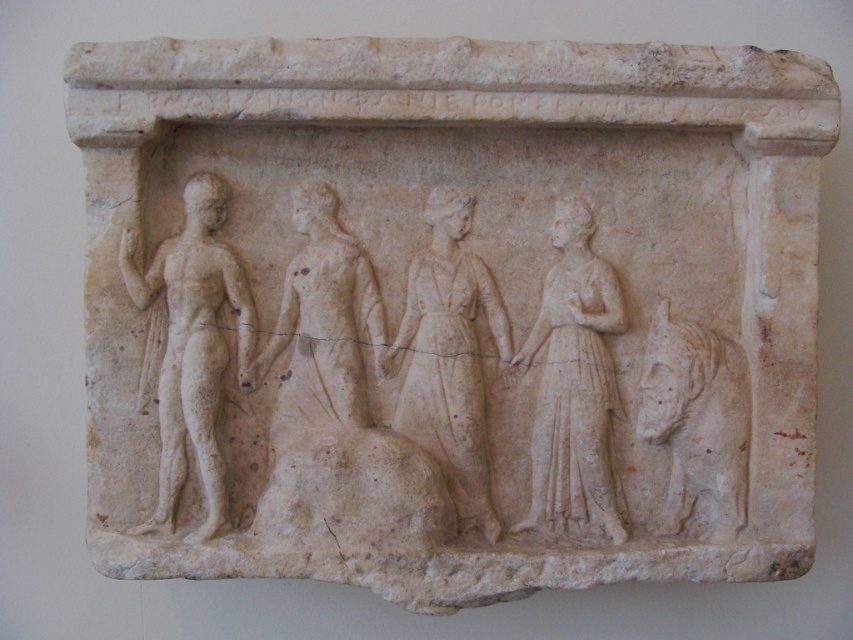
Can you confirm if smooth white figure at left is smaller than white stone horse at right?

No.

Is smooth white figure at left wider than white stone horse at right?

Indeed, smooth white figure at left has a greater width compared to white stone horse at right.

Locate an element on the screen. smooth white figure at left is located at coordinates (190, 348).

Which is in front, point (607, 456) or point (663, 426)?

Point (663, 426) is in front.

Is white marble figure at center to the left of white stone horse at right from the viewer's perspective?

Yes, white marble figure at center is to the left of white stone horse at right.

This screenshot has width=853, height=640. Identify the location of white marble figure at center. (573, 385).

Which of these two, white marble figure at center or smooth white figure at center, stands taller?

Standing taller between the two is white marble figure at center.

Does point (576, 432) come in front of point (338, 371)?

That is False.

Identify the location of white marble figure at center. This screenshot has width=853, height=640. (573, 385).